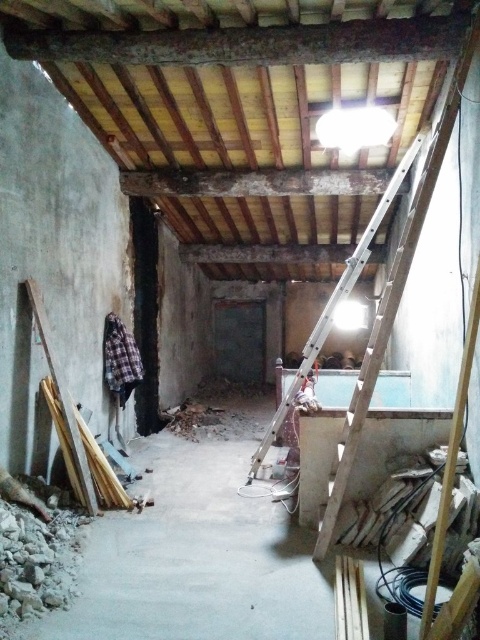
Does concrete floor at center lie in front of wooden ladder at upper right?

That is True.

Does concrete floor at center have a greater height compared to wooden ladder at upper right?

In fact, concrete floor at center may be shorter than wooden ladder at upper right.

Who is more forward, (250, 636) or (379, 346)?

Point (250, 636) is in front.

The height and width of the screenshot is (640, 480). Find the location of `concrete floor at center`. concrete floor at center is located at coordinates (195, 560).

Is concrete floor at center below silver metallic ladder at center?

Indeed, concrete floor at center is positioned under silver metallic ladder at center.

From the picture: Who is shorter, concrete floor at center or silver metallic ladder at center?

concrete floor at center

Is point (96, 609) less distant than point (396, 176)?

Yes, it is in front of point (396, 176).

At what (x,y) coordinates should I click in order to perform the action: click on concrete floor at center. Please return your answer as a coordinate pair (x, y). Looking at the image, I should click on (195, 560).

Can you confirm if wooden ladder at upper right is positioned below silver metallic ladder at center?

Indeed, wooden ladder at upper right is positioned under silver metallic ladder at center.

Who is lower down, wooden ladder at upper right or silver metallic ladder at center?

wooden ladder at upper right is lower down.

Measure the distance between wooden ladder at upper right and camera.

wooden ladder at upper right and camera are 2.74 meters apart from each other.

You are a GUI agent. You are given a task and a screenshot of the screen. Output one action in this format:
    pyautogui.click(x=<x>, y=<y>)
    Task: Click on the wooden ladder at upper right
    
    Given the screenshot: What is the action you would take?
    pyautogui.click(x=394, y=294)